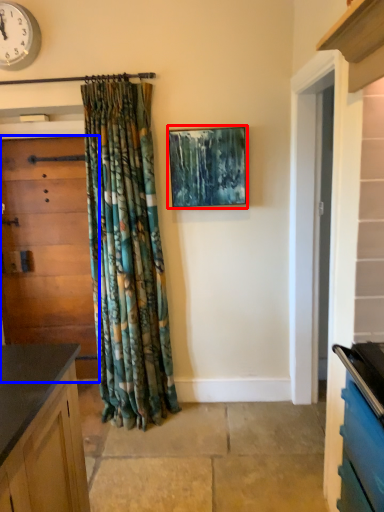
Question: Which of the following is the closest to the observer, picture frame (highlighted by a red box) or door (highlighted by a blue box)?

Choices:
 (A) picture frame
 (B) door

Answer: (A)